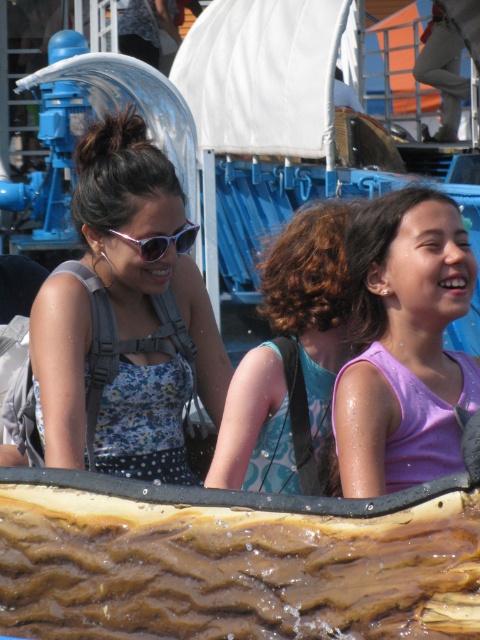
Question: Based on their relative distances, which object is farther from the floral fabric dress at left?

Choices:
 (A) purple matte tank top at center
 (B) matte pink plastic sunglasses at upper left

Answer: (A)

Question: Which of the following is the farthest from the observer?

Choices:
 (A) floral fabric dress at left
 (B) matte pink plastic sunglasses at upper left
 (C) teal fabric dress at center

Answer: (B)

Question: Can you confirm if floral fabric dress at left is positioned below teal fabric dress at center?

Choices:
 (A) no
 (B) yes

Answer: (A)

Question: Is floral fabric dress at left positioned in front of matte pink plastic sunglasses at upper left?

Choices:
 (A) no
 (B) yes

Answer: (B)

Question: Among these objects, which one is nearest to the camera?

Choices:
 (A) matte pink plastic sunglasses at upper left
 (B) purple matte tank top at center
 (C) floral fabric dress at left

Answer: (C)

Question: Can you confirm if floral fabric dress at left is positioned to the left of purple matte tank top at center?

Choices:
 (A) yes
 (B) no

Answer: (A)